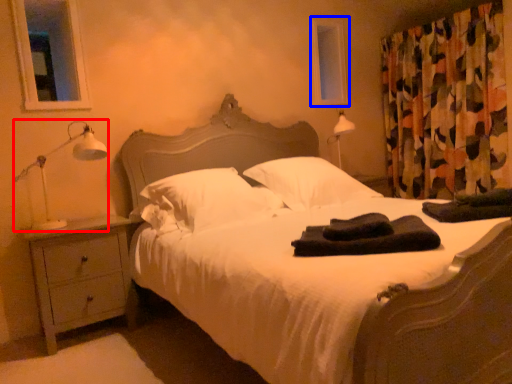
Question: Which object is closer to the camera taking this photo, table lamp (highlighted by a red box) or window screen (highlighted by a blue box)?

Choices:
 (A) table lamp
 (B) window screen

Answer: (A)